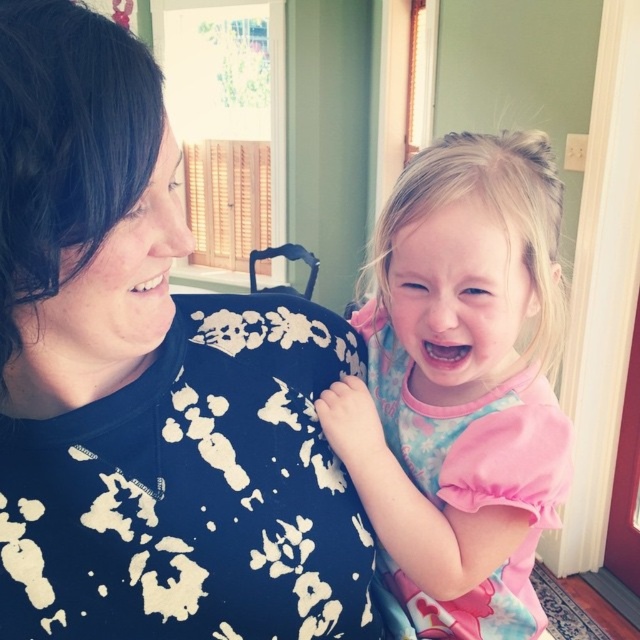
Question: Which point is closer to the camera?

Choices:
 (A) (538, 611)
 (B) (234, 444)

Answer: (B)

Question: Which point is closer to the camera?

Choices:
 (A) black floral shirt at upper left
 (B) pink fabric dress at center

Answer: (A)

Question: Is black floral shirt at upper left positioned behind pink fabric dress at center?

Choices:
 (A) yes
 (B) no

Answer: (B)

Question: Does black floral shirt at upper left appear on the right side of pink fabric dress at center?

Choices:
 (A) yes
 (B) no

Answer: (B)

Question: Which point appears closest to the camera in this image?

Choices:
 (A) (508, 236)
 (B) (115, 177)

Answer: (B)

Question: Is black floral shirt at upper left above pink fabric dress at center?

Choices:
 (A) yes
 (B) no

Answer: (B)